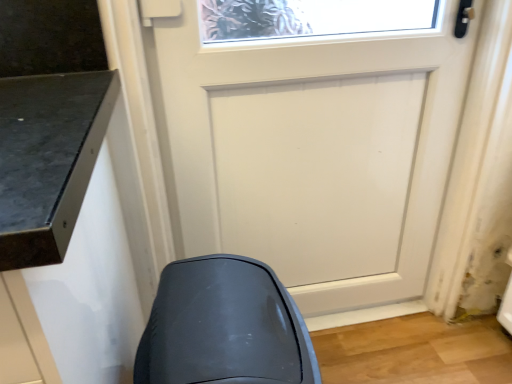
Question: Is matte gray swivel chair at lower left in front of or behind white matte door at center in the image?

Choices:
 (A) front
 (B) behind

Answer: (A)

Question: In terms of width, does matte gray swivel chair at lower left look wider or thinner when compared to white matte door at center?

Choices:
 (A) thin
 (B) wide

Answer: (B)

Question: From a real-world perspective, is matte gray swivel chair at lower left above or below white matte door at center?

Choices:
 (A) below
 (B) above

Answer: (A)

Question: Looking at their shapes, would you say white matte door at center is wider or thinner than matte gray swivel chair at lower left?

Choices:
 (A) thin
 (B) wide

Answer: (A)

Question: From the image's perspective, relative to matte gray swivel chair at lower left, is white matte door at center above or below?

Choices:
 (A) above
 (B) below

Answer: (A)

Question: Relative to matte gray swivel chair at lower left, is white matte door at center in front or behind?

Choices:
 (A) behind
 (B) front

Answer: (A)

Question: In terms of height, does white matte door at center look taller or shorter compared to matte gray swivel chair at lower left?

Choices:
 (A) short
 (B) tall

Answer: (B)